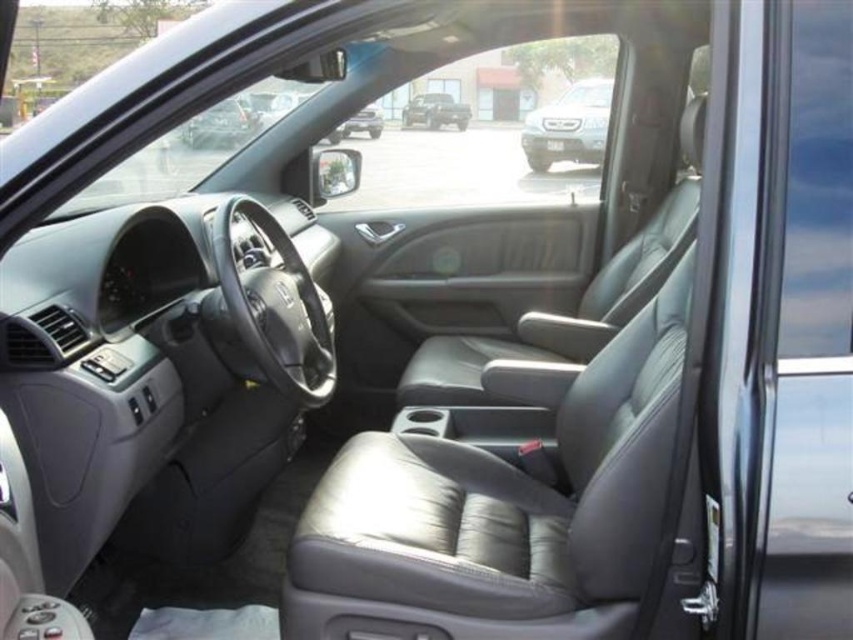
You are sitting in the driver seat of the car and notice two points marked on the dashboard. The first point is at coordinates point (602, 131) and the second is at point (351, 129). Which point is closer to you?

Point (602, 131) is closer to you because it is further to the viewer than point (351, 129).